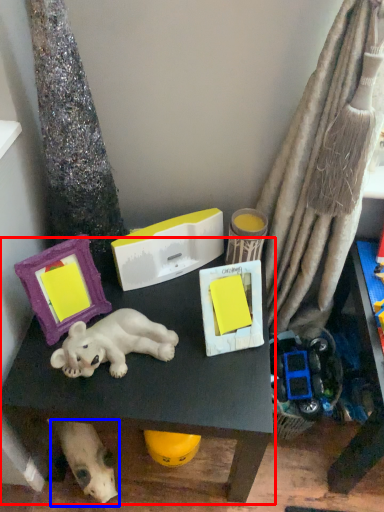
Question: Which object appears farthest to the camera in this image, table (highlighted by a red box) or dog (highlighted by a blue box)?

Choices:
 (A) table
 (B) dog

Answer: (B)